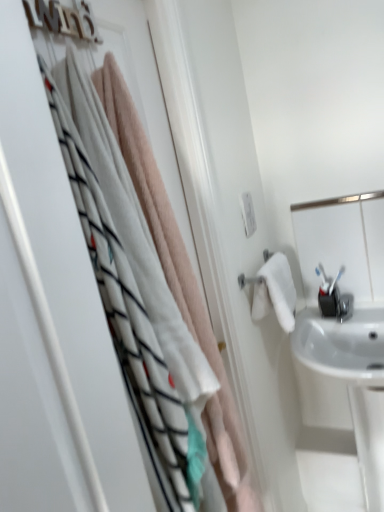
Question: From the image's perspective, is soft pink towel at upper left beneath white glossy sink at right?

Choices:
 (A) yes
 (B) no

Answer: (B)

Question: Considering the relative positions of soft pink towel at upper left and white glossy sink at right in the image provided, is soft pink towel at upper left to the left of white glossy sink at right from the viewer's perspective?

Choices:
 (A) yes
 (B) no

Answer: (A)

Question: Does soft pink towel at upper left have a smaller size compared to white glossy sink at right?

Choices:
 (A) no
 (B) yes

Answer: (B)

Question: Is soft pink towel at upper left directly adjacent to white glossy sink at right?

Choices:
 (A) no
 (B) yes

Answer: (A)

Question: Does soft pink towel at upper left turn towards white glossy sink at right?

Choices:
 (A) yes
 (B) no

Answer: (B)

Question: Considering the relative sizes of soft pink towel at upper left and white glossy sink at right in the image provided, is soft pink towel at upper left taller than white glossy sink at right?

Choices:
 (A) yes
 (B) no

Answer: (A)

Question: Is white glossy mirror at upper right oriented away from soft pink towel at upper left?

Choices:
 (A) no
 (B) yes

Answer: (A)

Question: Can soft pink towel at upper left be found inside white glossy mirror at upper right?

Choices:
 (A) yes
 (B) no

Answer: (B)

Question: Does white glossy mirror at upper right appear on the left side of soft pink towel at upper left?

Choices:
 (A) no
 (B) yes

Answer: (A)

Question: Is white glossy mirror at upper right bigger than soft pink towel at upper left?

Choices:
 (A) yes
 (B) no

Answer: (B)

Question: Is white glossy mirror at upper right taller than soft pink towel at upper left?

Choices:
 (A) no
 (B) yes

Answer: (A)

Question: From the image's perspective, would you say white glossy mirror at upper right is positioned over soft pink towel at upper left?

Choices:
 (A) yes
 (B) no

Answer: (A)

Question: From a real-world perspective, is white glossy mirror at upper right beneath white glossy sink at right?

Choices:
 (A) yes
 (B) no

Answer: (B)